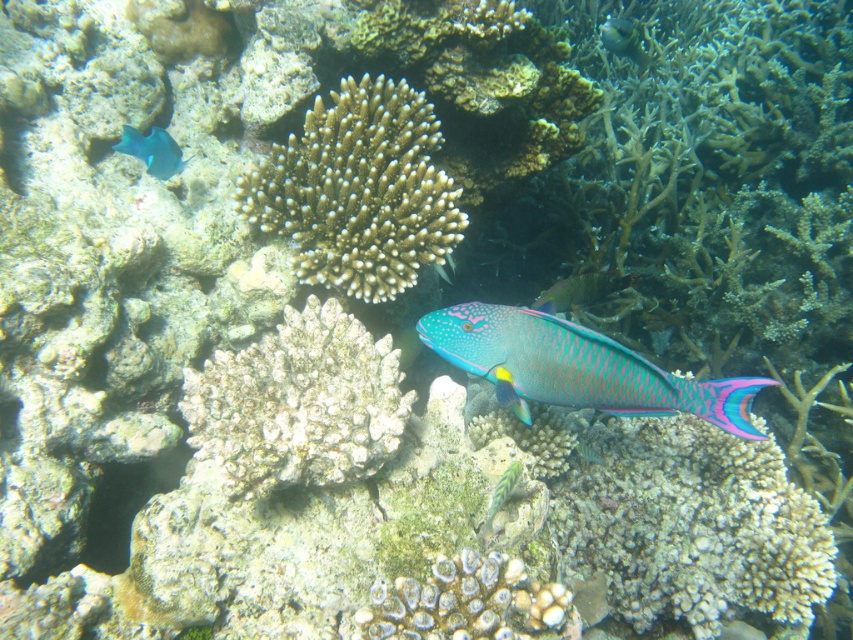
You are a marine biologist studying the underwater environment. You observe the white coral at center in the image. Can you determine its exact location based on the coordinate system provided?

The white coral at center is located at point (299, 404).

You are a marine biologist observing this underwater scene. You need to determine if the white coral at center can fit through a narrow opening in the reef that is only as wide as the shiny blue fish at upper left. Based on their sizes, what is your conclusion?

The white coral at center might be wider than the shiny blue fish at upper left, so it might not fit through the narrow opening in the reef that is as wide as the shiny blue fish at upper left.